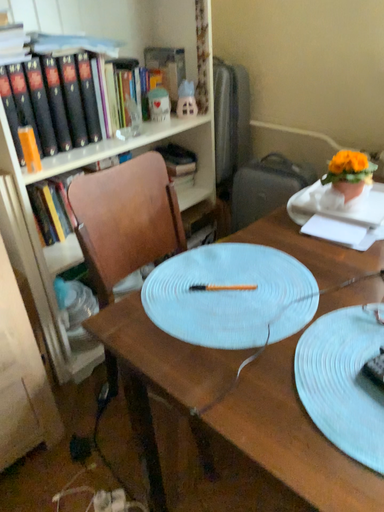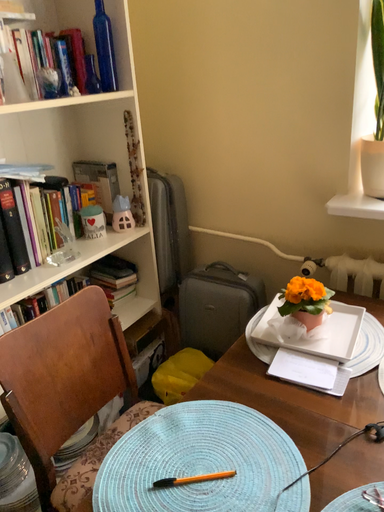
Question: How did the camera likely rotate when shooting the video?

Choices:
 (A) rotated right
 (B) rotated left

Answer: (A)